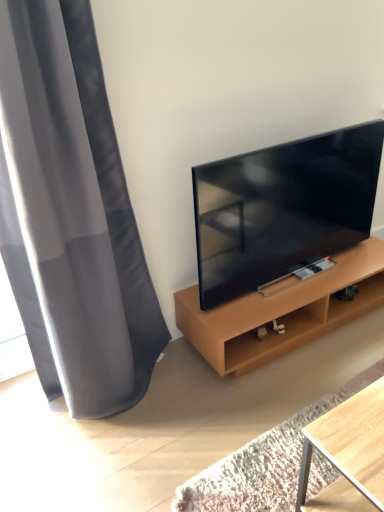
Image resolution: width=384 pixels, height=512 pixels. Identify the location of free point to the right of gray fabric curtain at left. (221, 412).